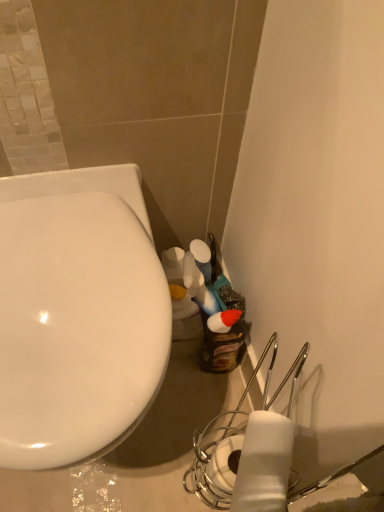
Locate an element on the screen. This screenshot has height=512, width=384. blank space above white glossy toilet at left (from a real-world perspective) is located at coordinates point(71,293).